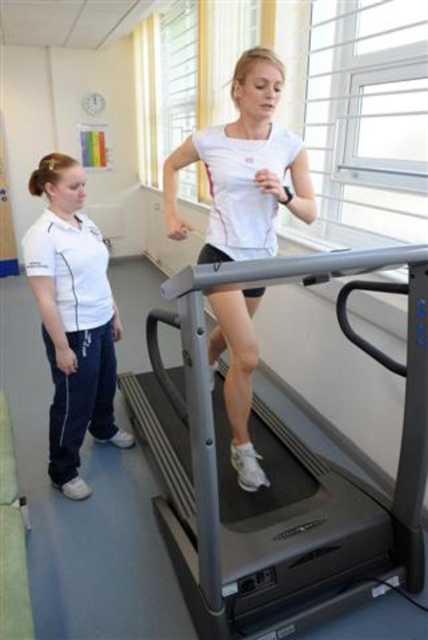
Question: Does white matte running shoe at center lie behind white cotton shirt at left?

Choices:
 (A) no
 (B) yes

Answer: (A)

Question: Among these objects, which one is farthest from the camera?

Choices:
 (A) gray metallic treadmill at center
 (B) white cotton shirt at left
 (C) white matte running shoe at center

Answer: (B)

Question: Is gray metallic treadmill at center to the right of white matte running shoe at center from the viewer's perspective?

Choices:
 (A) no
 (B) yes

Answer: (B)

Question: Among these objects, which one is nearest to the camera?

Choices:
 (A) white cotton shirt at left
 (B) gray metallic treadmill at center

Answer: (B)

Question: Where is gray metallic treadmill at center located in relation to white cotton shirt at left in the image?

Choices:
 (A) right
 (B) left

Answer: (A)

Question: Among these objects, which one is farthest from the camera?

Choices:
 (A) white matte running shoe at center
 (B) white cotton shirt at left

Answer: (B)